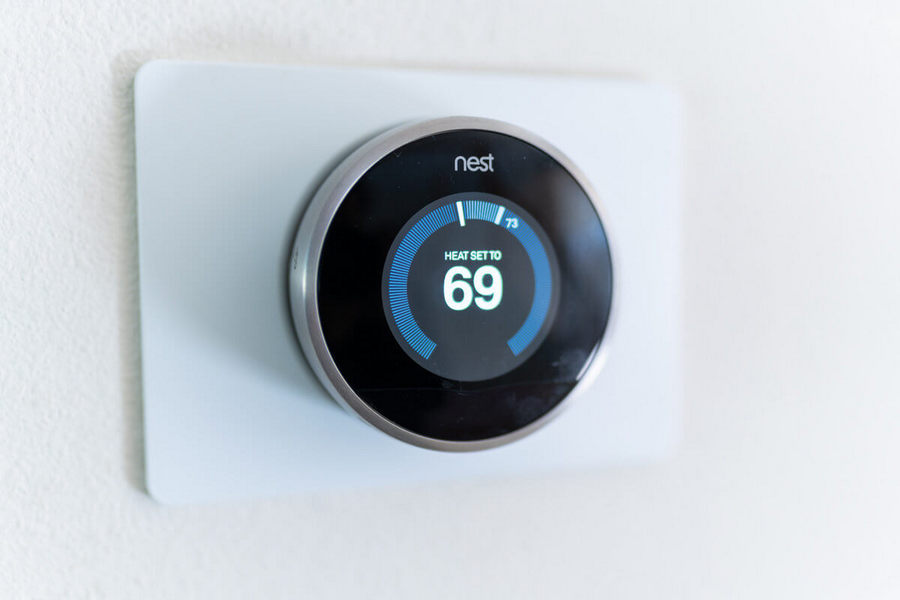
What are the coordinates of `rotating thermostat knob` in the screenshot? It's located at (430, 130).